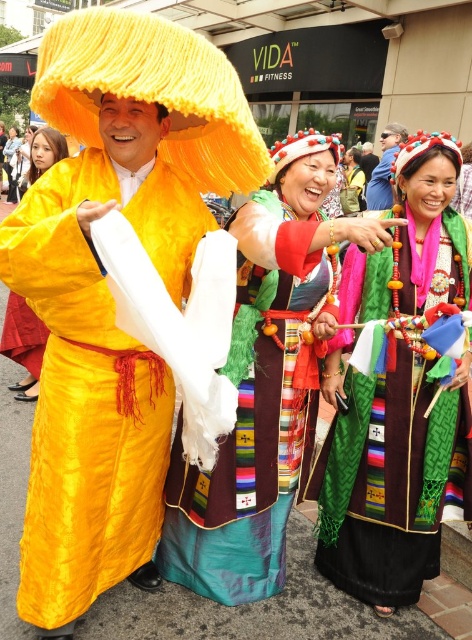
You are a photographer trying to capture a group photo of the three people in the scene. You want to ensure that both the textured green dress at center and the matte yellow robe at center are clearly visible. Given their sizes, which one might you need to position closer to the camera to ensure it doesn

The textured green dress at center is larger than the matte yellow robe at center. To ensure both are clearly visible, you might position the smaller matte yellow robe at center closer to the camera so its details are sharp while keeping the larger textured green dress at center slightly farther back to avoid overwhelming the frame.

You are a photographer planning to capture a closeup shot of the silky green dress at center and the matte black sunglasses at upper center. Given their sizes, which object should you focus on first to ensure it fits within your camera frame?

The silky green dress at center is bigger than the matte black sunglasses at upper center, so you should focus on the silky green dress at center first to ensure it fits within your camera frame before adjusting for the smaller matte black sunglasses at upper center.